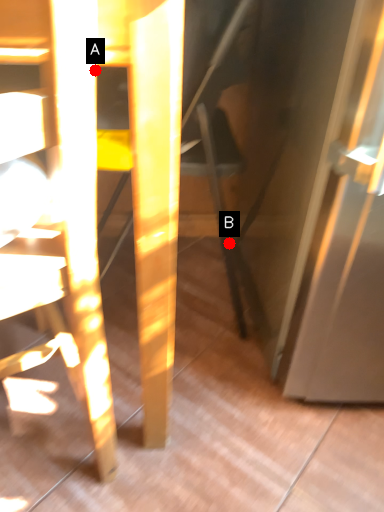
Question: Two points are circled on the image, labeled by A and B beside each circle. Among these points, which one is farthest from the camera?

Choices:
 (A) A is further
 (B) B is further

Answer: (B)